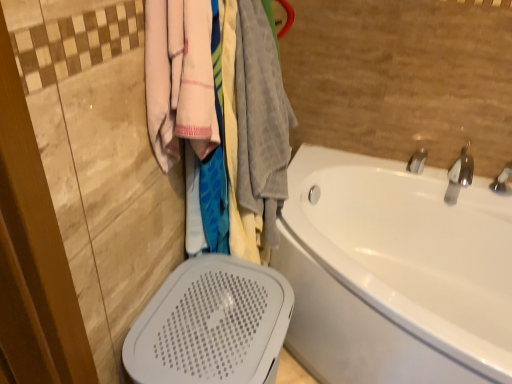
Question: Could soft cotton towels at upper left be considered to be inside white glossy bathtub at right?

Choices:
 (A) yes
 (B) no

Answer: (B)

Question: From the image's perspective, would you say white glossy bathtub at right is shown under soft cotton towels at upper left?

Choices:
 (A) yes
 (B) no

Answer: (A)

Question: Does white glossy bathtub at right have a lesser height compared to soft cotton towels at upper left?

Choices:
 (A) no
 (B) yes

Answer: (B)

Question: From the image's perspective, is white glossy bathtub at right on top of soft cotton towels at upper left?

Choices:
 (A) no
 (B) yes

Answer: (A)

Question: Is white glossy bathtub at right outside of soft cotton towels at upper left?

Choices:
 (A) yes
 (B) no

Answer: (A)

Question: Considering the positions of soft pink towel at upper left and soft cotton towels at upper left in the image, is soft pink towel at upper left wider or thinner than soft cotton towels at upper left?

Choices:
 (A) thin
 (B) wide

Answer: (A)

Question: Is soft pink towel at upper left in front of or behind soft cotton towels at upper left in the image?

Choices:
 (A) front
 (B) behind

Answer: (A)

Question: Is soft pink towel at upper left bigger or smaller than soft cotton towels at upper left?

Choices:
 (A) small
 (B) big

Answer: (A)

Question: From the image's perspective, relative to soft cotton towels at upper left, is soft pink towel at upper left above or below?

Choices:
 (A) above
 (B) below

Answer: (A)

Question: Is white glossy bathtub at right in front of or behind silver metallic tap at upper right, which is counted as the 1th tap, starting from the left, in the image?

Choices:
 (A) front
 (B) behind

Answer: (A)

Question: From a real-world perspective, is white glossy bathtub at right positioned above or below silver metallic tap at upper right, which is the 2th tap from right to left?

Choices:
 (A) above
 (B) below

Answer: (B)

Question: In terms of width, does white glossy bathtub at right look wider or thinner when compared to silver metallic tap at upper right, which is the 2th tap from right to left?

Choices:
 (A) thin
 (B) wide

Answer: (B)

Question: In terms of height, does white glossy bathtub at right look taller or shorter compared to silver metallic tap at upper right, which is counted as the 1th tap, starting from the left?

Choices:
 (A) tall
 (B) short

Answer: (A)

Question: Considering the positions of white glossy bathtub at right and silver metallic faucet at upper right, which ranks as the 1th tap in right-to-left order, in the image, is white glossy bathtub at right taller or shorter than silver metallic faucet at upper right, which ranks as the 1th tap in right-to-left order,?

Choices:
 (A) short
 (B) tall

Answer: (B)

Question: In the image, is white glossy bathtub at right positioned in front of or behind silver metallic faucet at upper right, which ranks as the 1th tap in right-to-left order?

Choices:
 (A) front
 (B) behind

Answer: (A)